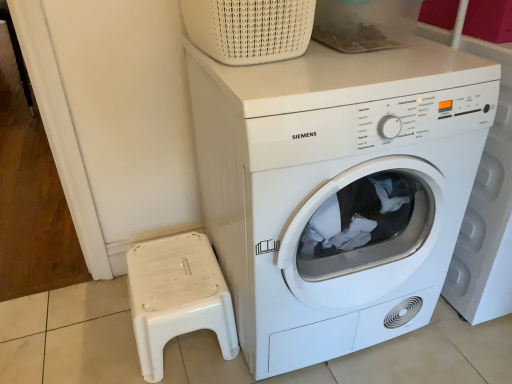
The height and width of the screenshot is (384, 512). I want to click on vacant space that is to the left of white plastic stool at lower left, so click(x=92, y=333).